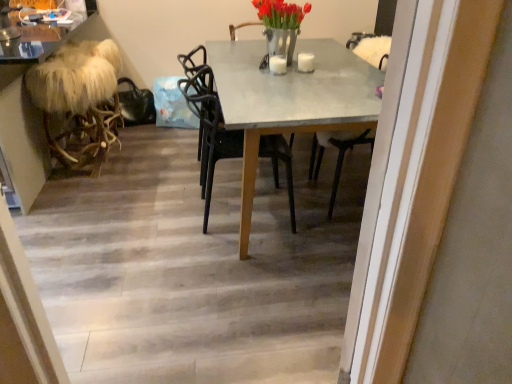
Find the location of a particular element. Image resolution: width=512 pixels, height=384 pixels. free space in front of black plastic chair at center is located at coordinates (234, 265).